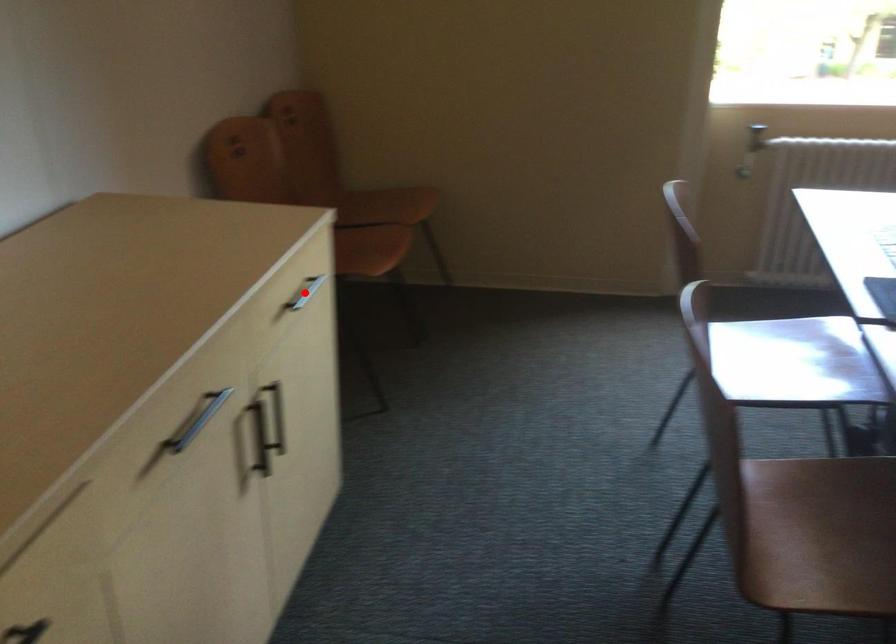
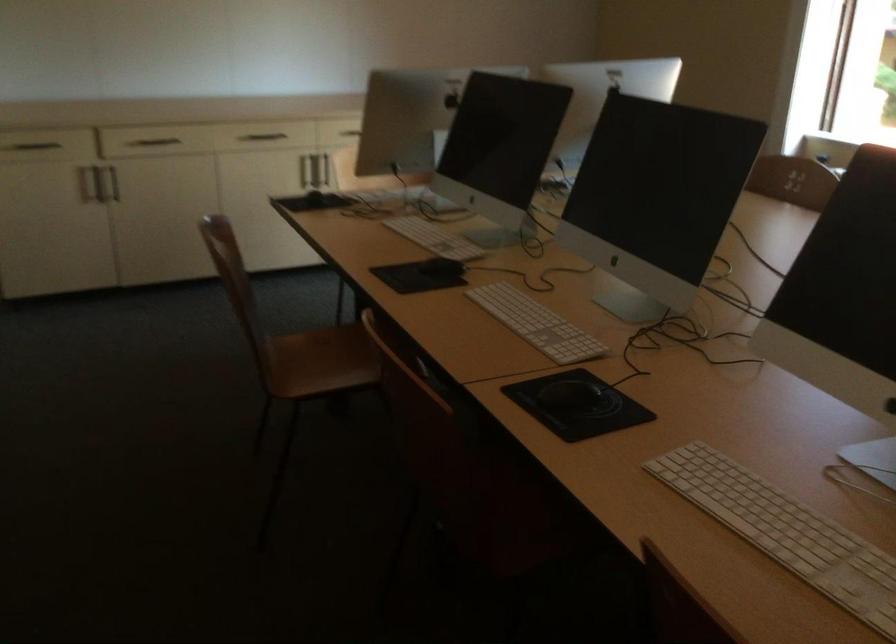
Question: I am providing you with two images of the same scene from different viewpoints. A red point is marked on the first image. At the location where the point appears in image 1, is it still visible in image 2?

Choices:
 (A) Yes
 (B) No

Answer: (B)